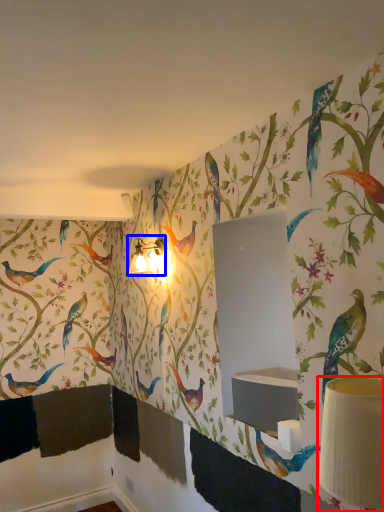
Question: Which object appears closest to the camera in this image, table lamp (highlighted by a red box) or table lamp (highlighted by a blue box)?

Choices:
 (A) table lamp
 (B) table lamp

Answer: (A)